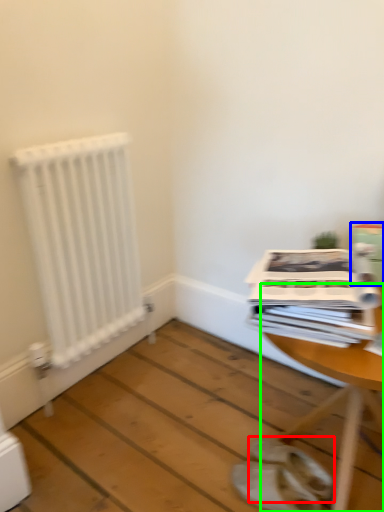
Question: Which object is positioned farthest from footwear (highlighted by a red box)? Select from cardboard box (highlighted by a blue box) and table (highlighted by a green box).

Choices:
 (A) cardboard box
 (B) table

Answer: (A)